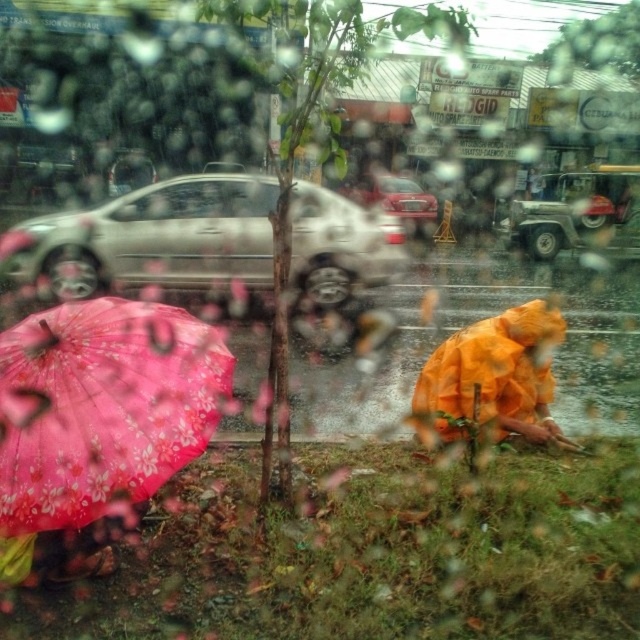
You are standing at the center of the image. There is a point marked at coordinates (150, 237). What object is located at that point?

The point at coordinates (150, 237) is where the satin silver car at left is located.

You are a delivery person trying to reach the shiny red sedan at center. There is a pink floral fabric umbrella at lower left in the way. Can you walk around it to get to the car?

The pink floral fabric umbrella at lower left is positioned under the shiny red sedan at center, so it is directly beneath the car. This means the umbrella is likely located underneath the vehicle, making it impossible to walk around it to reach the car from that position.